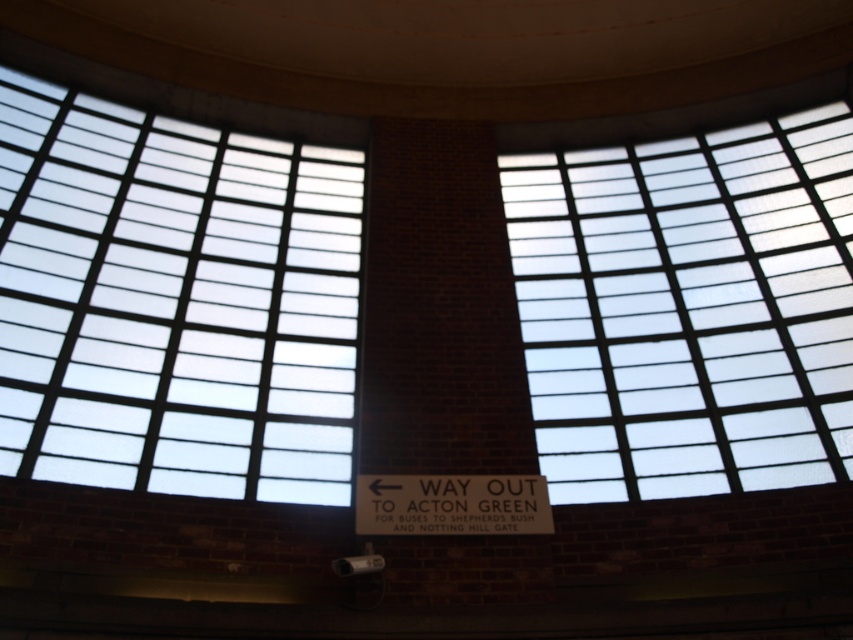
Question: Does clear glass window at upper right have a larger size compared to white matte sign at center?

Choices:
 (A) no
 (B) yes

Answer: (B)

Question: Considering the relative positions of clear glass window at upper left and white matte sign at center in the image provided, where is clear glass window at upper left located with respect to white matte sign at center?

Choices:
 (A) left
 (B) right

Answer: (A)

Question: Which is farther from the white matte sign at center?

Choices:
 (A) clear glass window at upper right
 (B) clear glass window at upper left

Answer: (A)

Question: Does clear glass window at upper left have a larger size compared to white matte sign at center?

Choices:
 (A) yes
 (B) no

Answer: (A)

Question: Which object is positioned closest to the clear glass window at upper right?

Choices:
 (A) white matte sign at center
 (B) clear glass window at upper left

Answer: (A)

Question: Considering the real-world distances, which object is farthest from the clear glass window at upper right?

Choices:
 (A) clear glass window at upper left
 (B) white matte sign at center

Answer: (A)